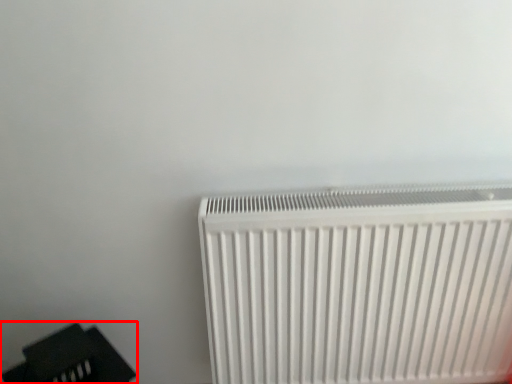
Question: From the image, what is the correct spatial relationship of furniture (annotated by the red box) in relation to radiator?

Choices:
 (A) right
 (B) left

Answer: (B)